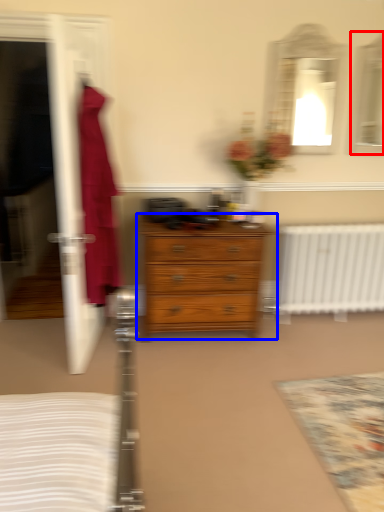
Question: Which object appears closest to the camera in this image, mirror (highlighted by a red box) or chest of drawers (highlighted by a blue box)?

Choices:
 (A) mirror
 (B) chest of drawers

Answer: (B)